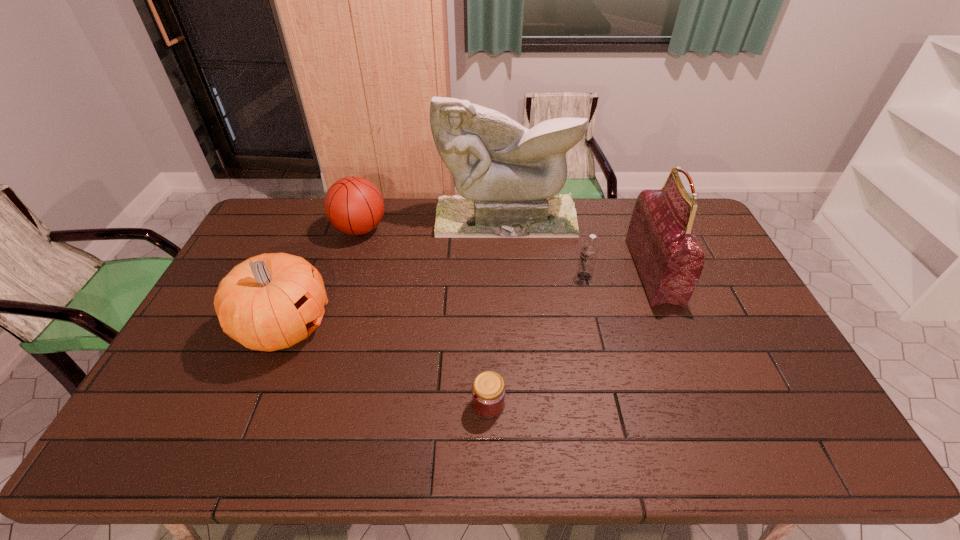
The width and height of the screenshot is (960, 540). I want to click on the tallest object, so click(508, 176).

This screenshot has width=960, height=540. What are the coordinates of `the rightmost object` in the screenshot? It's located at (669, 259).

Where is `handbag`? Image resolution: width=960 pixels, height=540 pixels. handbag is located at coordinates (669, 259).

At what (x,y) coordinates should I click in order to perform the action: click on pumpkin. Please return your answer as a coordinate pair (x, y). Looking at the image, I should click on (273, 301).

The width and height of the screenshot is (960, 540). I want to click on the fourth tallest object, so click(354, 205).

Locate an element on the screen. The image size is (960, 540). the fifth tallest object is located at coordinates (589, 251).

Locate an element on the screen. jam is located at coordinates click(488, 390).

Locate an element on the screen. the nearest object is located at coordinates (488, 390).

Identify the location of free space located 0.080m on the base of the sculpture. (508, 252).

Identify the location of vacant area located on the front-facing side of the rightmost object. (615, 271).